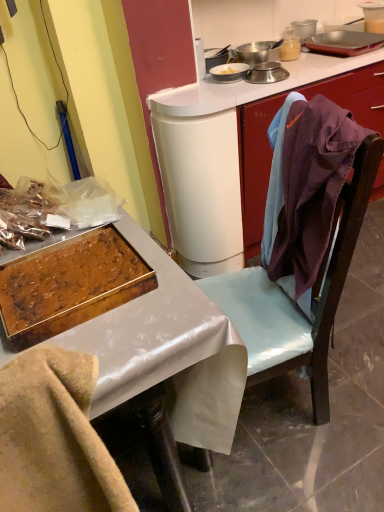
Question: From a real-world perspective, is metallic silver pot at upper center, marked as the second appliance in a top-to-bottom arrangement, beneath translucent glass jar at upper center, the 3th appliance in the bottom-to-top sequence?

Choices:
 (A) yes
 (B) no

Answer: (A)

Question: Does metallic silver pot at upper center, which is the second appliance from bottom to top, have a smaller size compared to translucent glass jar at upper center, placed as the first appliance when sorted from top to bottom?

Choices:
 (A) no
 (B) yes

Answer: (A)

Question: Is metallic silver pot at upper center, which is the second appliance from bottom to top, oriented towards translucent glass jar at upper center, the 3th appliance in the bottom-to-top sequence?

Choices:
 (A) yes
 (B) no

Answer: (B)

Question: Is metallic silver pot at upper center, which is the second appliance from bottom to top, taller than translucent glass jar at upper center, the 3th appliance in the bottom-to-top sequence?

Choices:
 (A) no
 (B) yes

Answer: (A)

Question: From the image's perspective, is metallic silver pot at upper center, marked as the second appliance in a top-to-bottom arrangement, on top of translucent glass jar at upper center, placed as the first appliance when sorted from top to bottom?

Choices:
 (A) yes
 (B) no

Answer: (B)

Question: Is translucent glass jar at upper center, placed as the first appliance when sorted from top to bottom, located within metallic silver pot at upper center, which is the second appliance from bottom to top?

Choices:
 (A) yes
 (B) no

Answer: (B)

Question: Is purple fabric at right touching metallic silver scale at upper center, the third appliance positioned from the top?

Choices:
 (A) yes
 (B) no

Answer: (B)

Question: Is purple fabric at right to the left of metallic silver scale at upper center, the 1th appliance positioned from the bottom, from the viewer's perspective?

Choices:
 (A) yes
 (B) no

Answer: (A)

Question: Is purple fabric at right completely or partially outside of metallic silver scale at upper center, the third appliance positioned from the top?

Choices:
 (A) yes
 (B) no

Answer: (A)

Question: From the image's perspective, is purple fabric at right over metallic silver scale at upper center, the third appliance positioned from the top?

Choices:
 (A) no
 (B) yes

Answer: (A)

Question: Is purple fabric at right not near metallic silver scale at upper center, the 1th appliance positioned from the bottom?

Choices:
 (A) no
 (B) yes

Answer: (A)

Question: Is purple fabric at right wider than metallic silver scale at upper center, the third appliance positioned from the top?

Choices:
 (A) no
 (B) yes

Answer: (B)

Question: Can you confirm if metallic tray at left is positioned to the right of metallic silver scale at upper center, the 1th appliance positioned from the bottom?

Choices:
 (A) yes
 (B) no

Answer: (B)